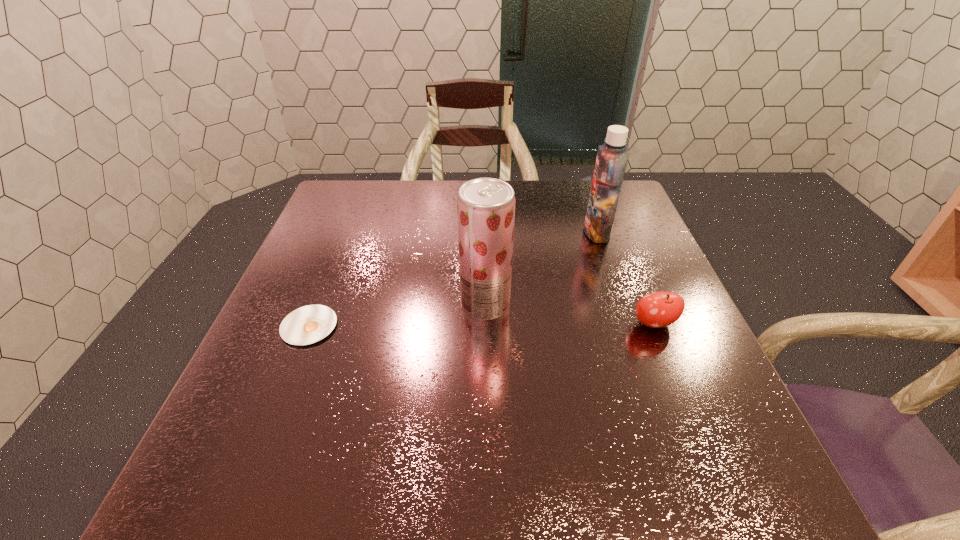
Locate an element on the screen. The height and width of the screenshot is (540, 960). free space between the fruit juice and the apple is located at coordinates (569, 314).

I want to click on unoccupied position between the egg yolk and the apple, so click(482, 325).

Identify which object is the second nearest to the fruit juice. Please provide its 2D coordinates. Your answer should be formatted as a tuple, i.e. [(x, y)], where the tuple contains the x and y coordinates of a point satisfying the conditions above.

[(309, 324)]

Find the location of `object that is the third nearest to the shampoo`. object that is the third nearest to the shampoo is located at coordinates (309, 324).

Image resolution: width=960 pixels, height=540 pixels. I want to click on vacant area in the image that satisfies the following two spatial constraints: 1. on the front label of the shampoo; 2. on the right side of the third tallest object, so click(x=629, y=324).

The width and height of the screenshot is (960, 540). Find the location of `vacant area in the image that satisfies the following two spatial constraints: 1. on the front label of the farthest object; 2. on the front side of the third object from right to left`. vacant area in the image that satisfies the following two spatial constraints: 1. on the front label of the farthest object; 2. on the front side of the third object from right to left is located at coordinates (622, 305).

This screenshot has height=540, width=960. I want to click on vacant area in the image that satisfies the following two spatial constraints: 1. on the front label of the second shortest object; 2. on the left side of the farthest object, so click(x=629, y=324).

Locate an element on the screen. blank space that satisfies the following two spatial constraints: 1. on the front label of the farthest object; 2. on the front side of the fruit juice is located at coordinates (622, 305).

Where is `vacant area that satisfies the following two spatial constraints: 1. on the front label of the shampoo; 2. on the left side of the second shortest object`? vacant area that satisfies the following two spatial constraints: 1. on the front label of the shampoo; 2. on the left side of the second shortest object is located at coordinates (629, 324).

Identify the location of vacant space that satisfies the following two spatial constraints: 1. on the front label of the shampoo; 2. on the front side of the fruit juice. (622, 305).